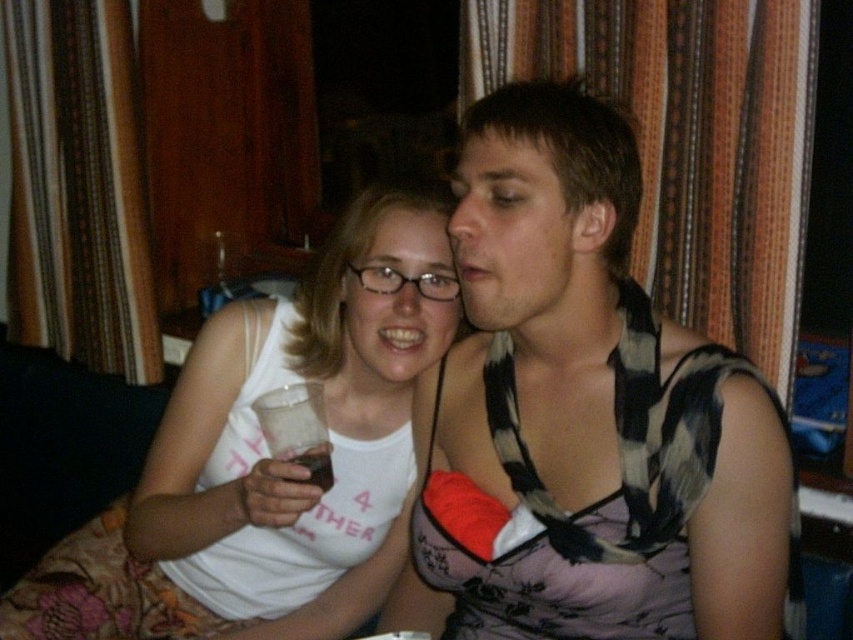
Question: Among these objects, which one is nearest to the camera?

Choices:
 (A) white matte tank top at center
 (B) checkered fabric shirt at center
 (C) translucent plastic cup at lower center

Answer: (B)

Question: Can you confirm if white matte tank top at center is positioned to the left of translucent plastic cup at lower center?

Choices:
 (A) no
 (B) yes

Answer: (B)

Question: Which point is closer to the camera?

Choices:
 (A) (643, 388)
 (B) (294, 456)

Answer: (A)

Question: Can you confirm if checkered fabric shirt at center is positioned to the right of translucent plastic cup at lower center?

Choices:
 (A) no
 (B) yes

Answer: (B)

Question: Which point is farther from the camera taking this photo?

Choices:
 (A) (345, 438)
 (B) (332, 474)

Answer: (A)

Question: Is checkered fabric shirt at center closer to camera compared to translucent plastic cup at lower center?

Choices:
 (A) yes
 (B) no

Answer: (A)